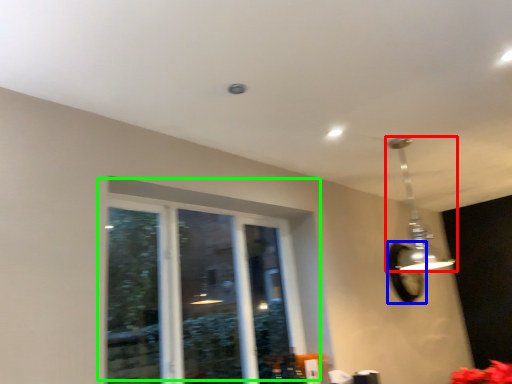
Question: Which object is positioned farthest from lamp (highlighted by a red box)? Select from mirror (highlighted by a blue box) and window (highlighted by a green box).

Choices:
 (A) mirror
 (B) window

Answer: (B)